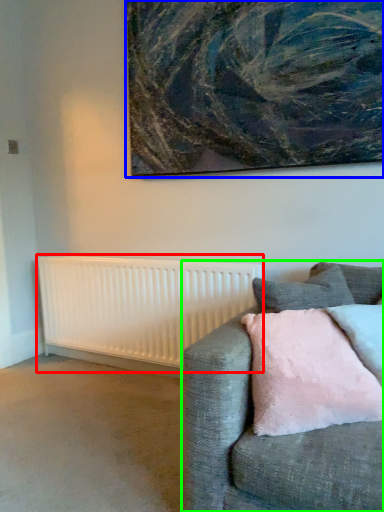
Question: Which object is the closest to the radiator (highlighted by a red box)? Choose among these: picture frame (highlighted by a blue box) or studio couch (highlighted by a green box).

Choices:
 (A) picture frame
 (B) studio couch

Answer: (A)